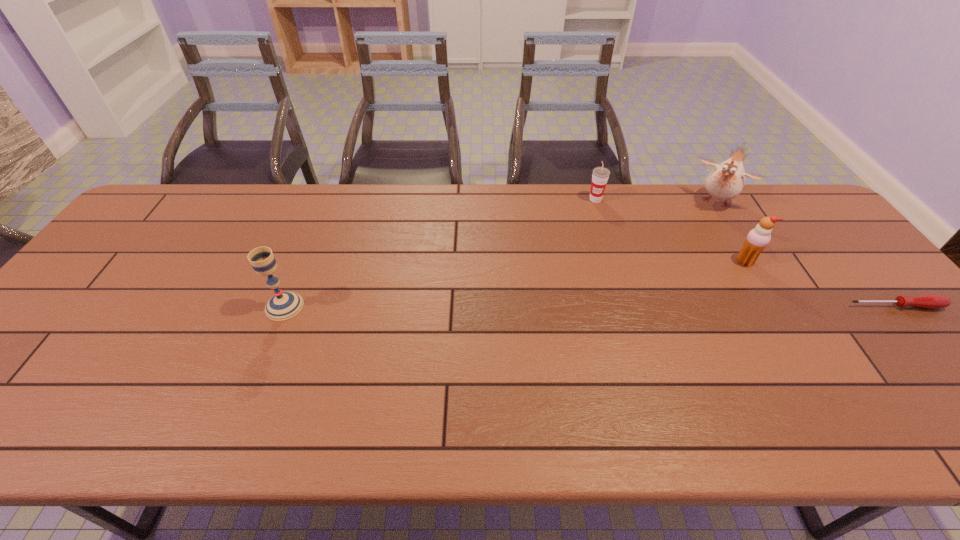
In order to click on free spot on the desktop that is between the chalice and the rightmost object and is positioned at the beak of the bird in this screenshot , I will do `click(655, 306)`.

Where is `vacant space on the desktop that is between the chalice and the screwdriver and is positioned at the front with a straw on the third farthest object`? Image resolution: width=960 pixels, height=540 pixels. vacant space on the desktop that is between the chalice and the screwdriver and is positioned at the front with a straw on the third farthest object is located at coordinates point(675,306).

Image resolution: width=960 pixels, height=540 pixels. In order to click on vacant spot on the desktop that is between the chalice and the screwdriver and is positioned on the side of the second shortest object with the logo in this screenshot , I will do `click(612, 306)`.